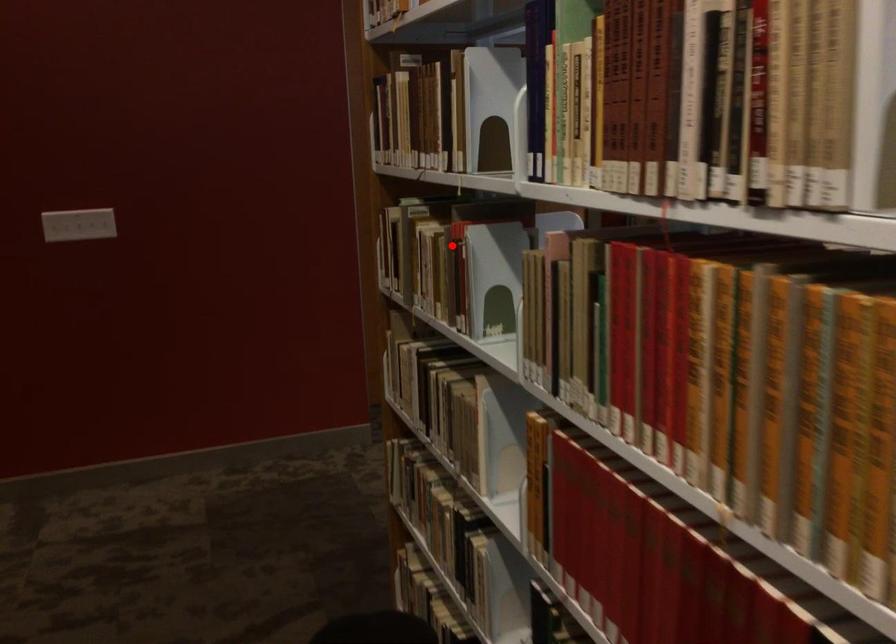
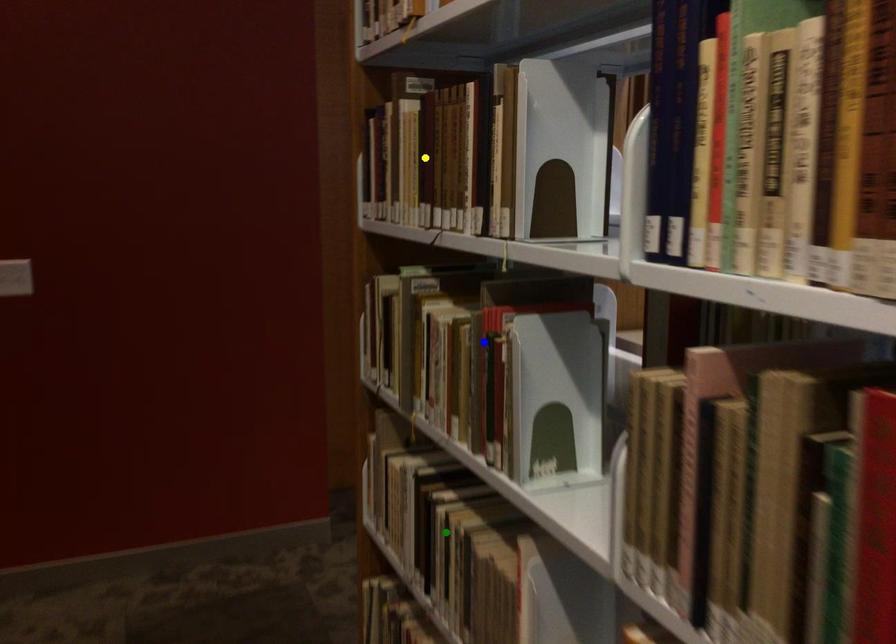
Question: I am providing you with two images of the same scene from different viewpoints. A red point is marked on the first image. You are given multiple points on the second image. In image 2, which mark is for the same physical point as the one in image 1?

Choices:
 (A) blue point
 (B) yellow point
 (C) green point

Answer: (A)